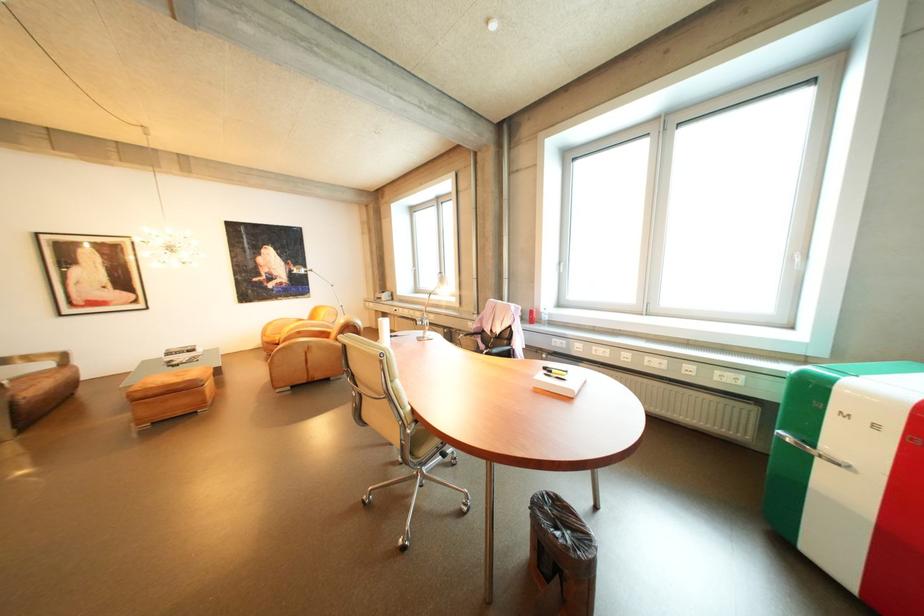
Locate an element on the screen. floor lamp head is located at coordinates (297, 269).